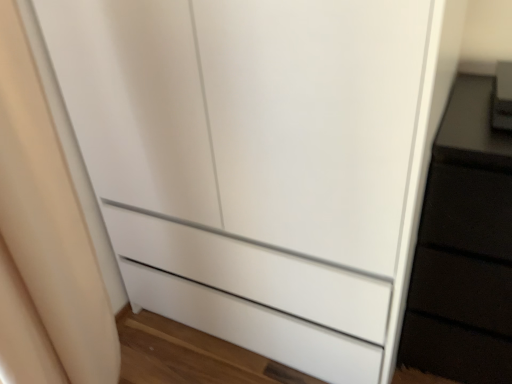
Locate an element on the screen. beige fabric curtain at left is located at coordinates (44, 240).

The height and width of the screenshot is (384, 512). What do you see at coordinates (44, 240) in the screenshot? I see `beige fabric curtain at left` at bounding box center [44, 240].

What is the approximate height of beige fabric curtain at left?

A: beige fabric curtain at left is 1.11 meters in height.

The height and width of the screenshot is (384, 512). Describe the element at coordinates (502, 97) in the screenshot. I see `satin black phone at upper right` at that location.

Where is `satin black phone at upper right`? This screenshot has width=512, height=384. satin black phone at upper right is located at coordinates (502, 97).

Find the location of `beige fabric curtain at left`. beige fabric curtain at left is located at coordinates (44, 240).

Considering the positions of objects satin black phone at upper right and beige fabric curtain at left in the image provided, who is more to the right, satin black phone at upper right or beige fabric curtain at left?

satin black phone at upper right.

Based on the photo, is the position of satin black phone at upper right more distant than that of beige fabric curtain at left?

That is True.

Is point (505, 107) more distant than point (3, 358)?

Yes, it is behind point (3, 358).

From the image's perspective, is satin black phone at upper right above beige fabric curtain at left?

Yes, from the image's perspective, satin black phone at upper right is above beige fabric curtain at left.

From a real-world perspective, between satin black phone at upper right and beige fabric curtain at left, who is vertically lower?

beige fabric curtain at left is physically lower.

In terms of width, does satin black phone at upper right look wider or thinner when compared to beige fabric curtain at left?

Clearly, satin black phone at upper right has less width compared to beige fabric curtain at left.

Does satin black phone at upper right have a lesser height compared to beige fabric curtain at left?

Indeed, satin black phone at upper right has a lesser height compared to beige fabric curtain at left.

In terms of size, does satin black phone at upper right appear bigger or smaller than beige fabric curtain at left?

satin black phone at upper right is smaller than beige fabric curtain at left.

Is satin black phone at upper right not within beige fabric curtain at left?

Yes, satin black phone at upper right is outside of beige fabric curtain at left.

Consider the image. Is satin black phone at upper right in contact with beige fabric curtain at left?

satin black phone at upper right and beige fabric curtain at left are clearly separated.

Is satin black phone at upper right turned away from beige fabric curtain at left?

No, satin black phone at upper right is not facing the opposite direction of beige fabric curtain at left.

How many degrees apart are the facing directions of satin black phone at upper right and beige fabric curtain at left?

87.7 degrees separate the facing orientations of satin black phone at upper right and beige fabric curtain at left.

This screenshot has height=384, width=512. In order to click on appliance above the beige fabric curtain at left (from a real-world perspective) in this screenshot , I will do `click(502, 97)`.

In the scene shown: Is beige fabric curtain at left to the right of satin black phone at upper right from the viewer's perspective?

No, beige fabric curtain at left is not to the right of satin black phone at upper right.

Consider the image. Which object is closer to the camera, beige fabric curtain at left or satin black phone at upper right?

beige fabric curtain at left is closer to the camera.

Does point (79, 367) lie behind point (498, 90)?

No.

From the image's perspective, relative to satin black phone at upper right, is beige fabric curtain at left above or below?

Clearly, from the image's perspective, beige fabric curtain at left is below satin black phone at upper right.

From a real-world perspective, is beige fabric curtain at left physically located above or below satin black phone at upper right?

From a real-world perspective, beige fabric curtain at left is physically below satin black phone at upper right.

Considering the sizes of beige fabric curtain at left and satin black phone at upper right in the image, is beige fabric curtain at left wider or thinner than satin black phone at upper right?

In the image, beige fabric curtain at left appears to be wider than satin black phone at upper right.

Does beige fabric curtain at left have a lesser height compared to satin black phone at upper right?

In fact, beige fabric curtain at left may be taller than satin black phone at upper right.

Is beige fabric curtain at left bigger than satin black phone at upper right?

Indeed, beige fabric curtain at left has a larger size compared to satin black phone at upper right.

Is beige fabric curtain at left completely or partially outside of satin black phone at upper right?

Absolutely, beige fabric curtain at left is external to satin black phone at upper right.

Does beige fabric curtain at left touch satin black phone at upper right?

No, beige fabric curtain at left is not touching satin black phone at upper right.

Could you tell me if beige fabric curtain at left is turned towards satin black phone at upper right?

No.

What's the angular difference between beige fabric curtain at left and satin black phone at upper right's facing directions?

The facing directions of beige fabric curtain at left and satin black phone at upper right are 87.7 degrees apart.

How much distance is there between beige fabric curtain at left and satin black phone at upper right?

beige fabric curtain at left and satin black phone at upper right are 1.00 meters apart.

Locate an element on the screen. The image size is (512, 384). curtain located underneath the satin black phone at upper right (from a real-world perspective) is located at coordinates coord(44,240).

The width and height of the screenshot is (512, 384). I want to click on curtain that is under the satin black phone at upper right (from a real-world perspective), so click(x=44, y=240).

Locate an element on the screen. This screenshot has width=512, height=384. curtain in front of the satin black phone at upper right is located at coordinates (44, 240).